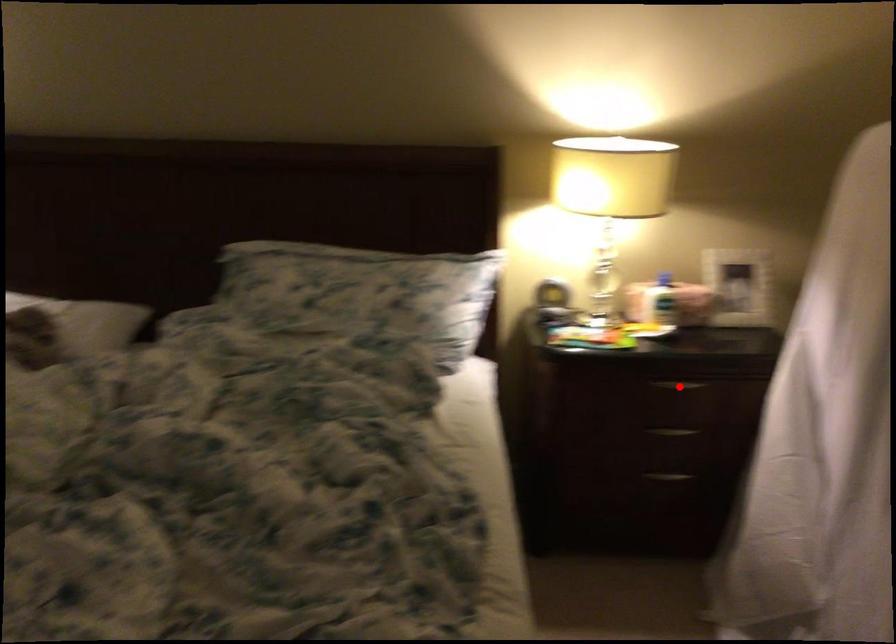
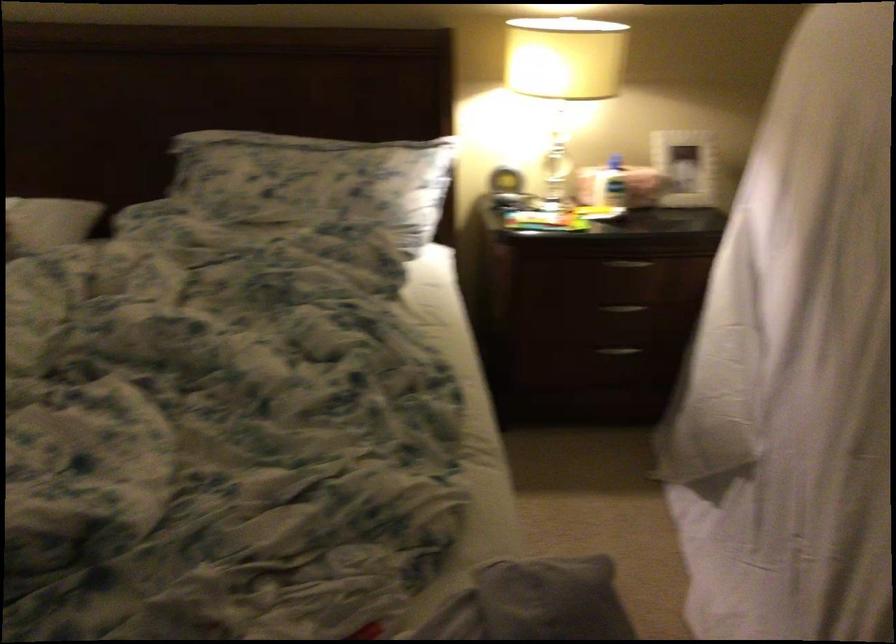
Where in the second image is the point corresponding to the highlighted location from the first image?

(627, 263)